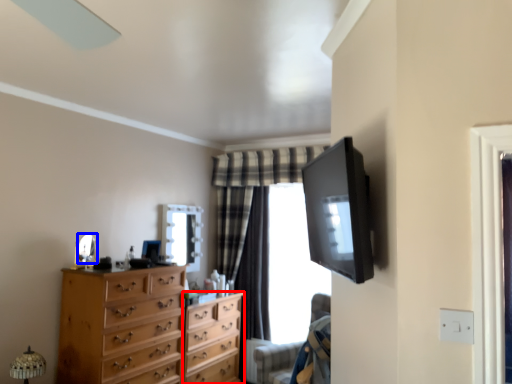
Question: Which object is closer to the camera taking this photo, chest of drawers (highlighted by a red box) or mirror (highlighted by a blue box)?

Choices:
 (A) chest of drawers
 (B) mirror

Answer: (B)